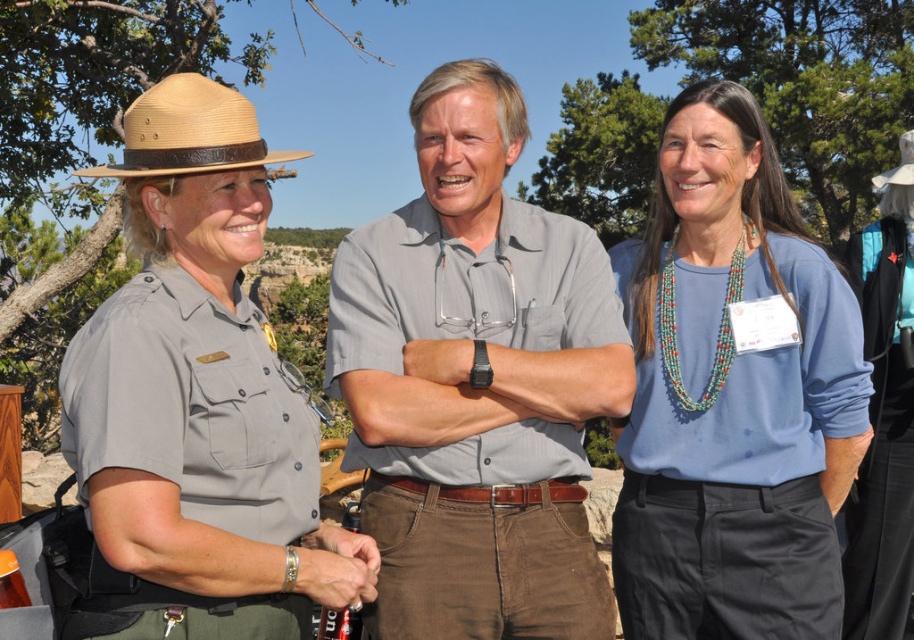
Question: Which point appears farthest from the camera in this image?

Choices:
 (A) (889, 502)
 (B) (704, 620)
 (C) (910, 179)
 (D) (291, 540)

Answer: (C)

Question: Which point is farther from the camera taking this photo?

Choices:
 (A) (900, 180)
 (B) (177, 157)
 (C) (445, 353)
 (D) (889, 486)

Answer: (A)

Question: Observing the image, what is the correct spatial positioning of metallic silver pen at center in reference to straw hat at center?

Choices:
 (A) left
 (B) right

Answer: (A)

Question: Considering the relative positions of gray cotton shirt at center and natural straw cowboy hat at upper left in the image provided, where is gray cotton shirt at center located with respect to natural straw cowboy hat at upper left?

Choices:
 (A) below
 (B) above

Answer: (A)

Question: Is blue fabric shirt at center wider than natural straw cowboy hat at upper left?

Choices:
 (A) yes
 (B) no

Answer: (A)

Question: Among these points, which one is farthest from the camera?

Choices:
 (A) (619, 346)
 (B) (96, 172)
 (C) (898, 170)

Answer: (C)